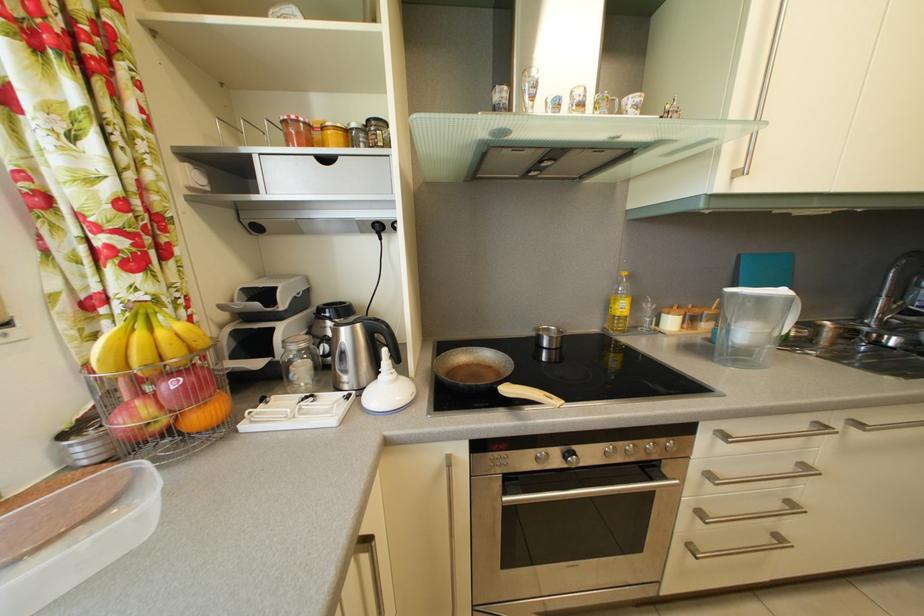
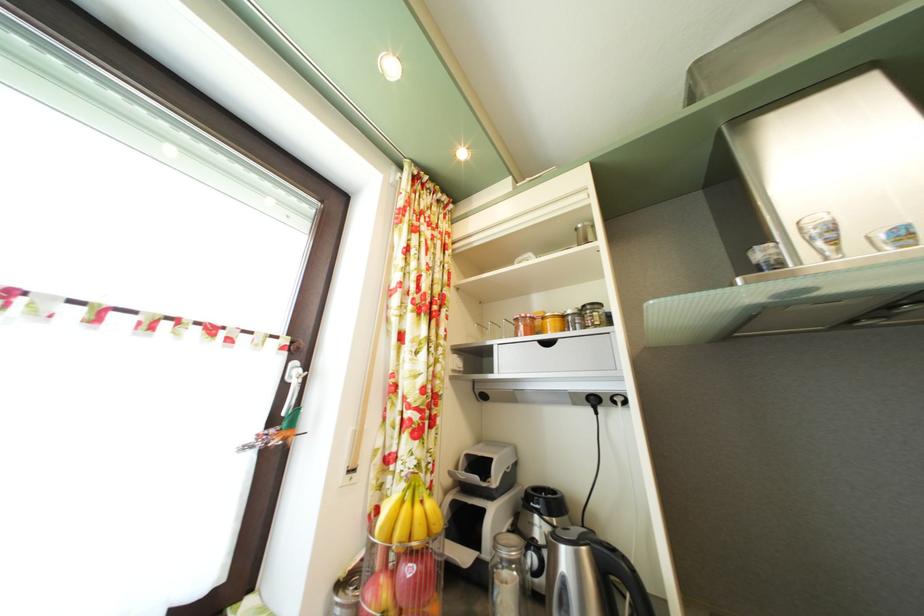
Where in the second image is the point corresponding to [168,339] from the first image?

(426, 516)